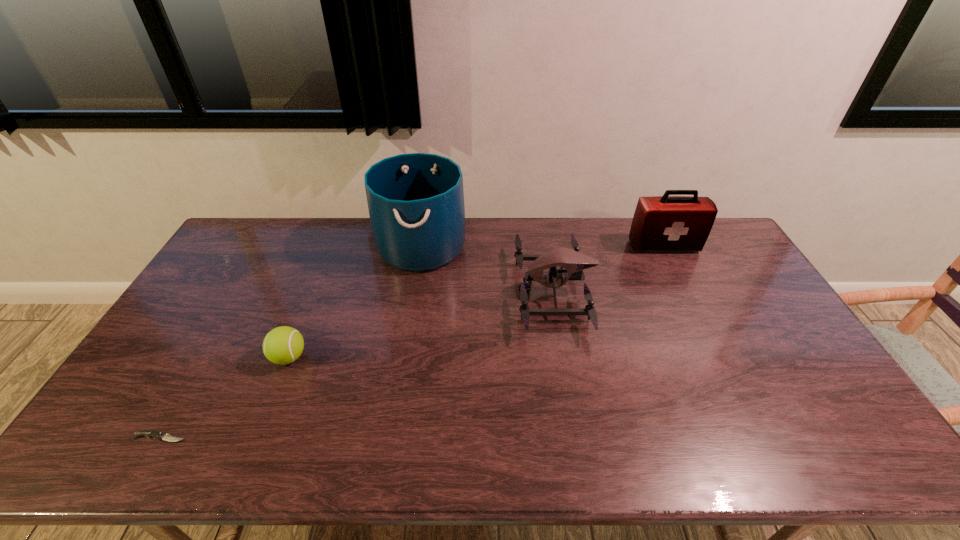
Locate an element on the screen. The width and height of the screenshot is (960, 540). free spot that satisfies the following two spatial constraints: 1. on the side of the first aid kit with the cross symbol; 2. on the front-facing side of the third shortest object is located at coordinates (686, 292).